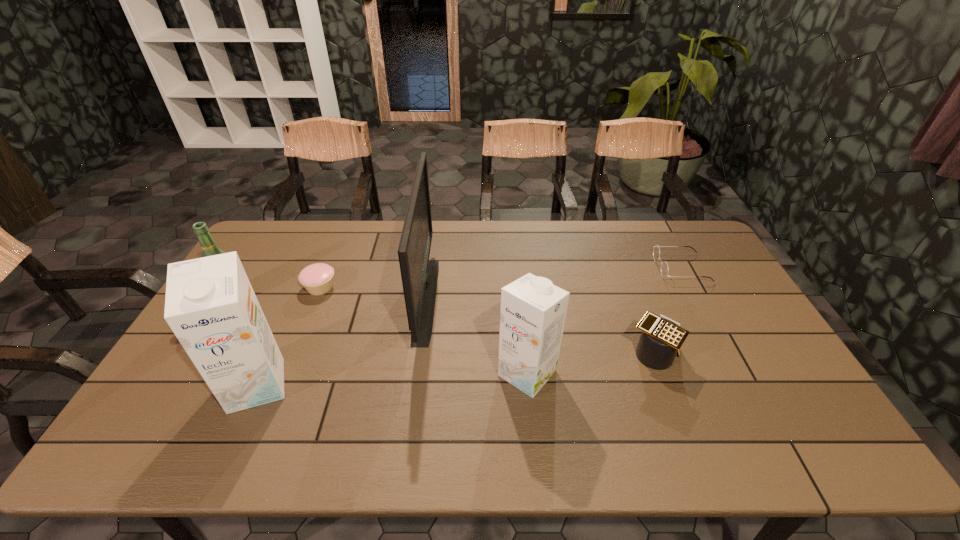
You are a GUI agent. You are given a task and a screenshot of the screen. Output one action in this format:
    pyautogui.click(x=<x>, y=<y>)
    Task: Click on the vacant space that is in between the calculator and the taller carton
    Image resolution: width=960 pixels, height=540 pixels.
    Given the screenshot: What is the action you would take?
    pyautogui.click(x=455, y=370)

Identify the location of free space between the leftmost object and the right carton. (381, 335).

The image size is (960, 540). I want to click on vacant space in between the left carton and the cupcake, so click(x=288, y=336).

The width and height of the screenshot is (960, 540). In order to click on free spot between the left carton and the fifth object from left to right in this screenshot , I will do `click(392, 379)`.

The width and height of the screenshot is (960, 540). I want to click on free space between the spectacles and the second object from right to left, so click(x=667, y=311).

Locate an element on the screen. vacant space in between the fourth object from right to left and the taller carton is located at coordinates (342, 342).

Find the location of a particular element. free spot between the calculator and the beer bottle is located at coordinates (444, 326).

Where is `empty location between the left carton and the fourth object from left to right`? empty location between the left carton and the fourth object from left to right is located at coordinates (x=342, y=342).

Identify the location of vacant area between the fifth object from left to right and the third shortest object. This screenshot has height=540, width=960. (590, 363).

Find the location of `free spot between the rightmost object and the shorter carton`. free spot between the rightmost object and the shorter carton is located at coordinates (604, 321).